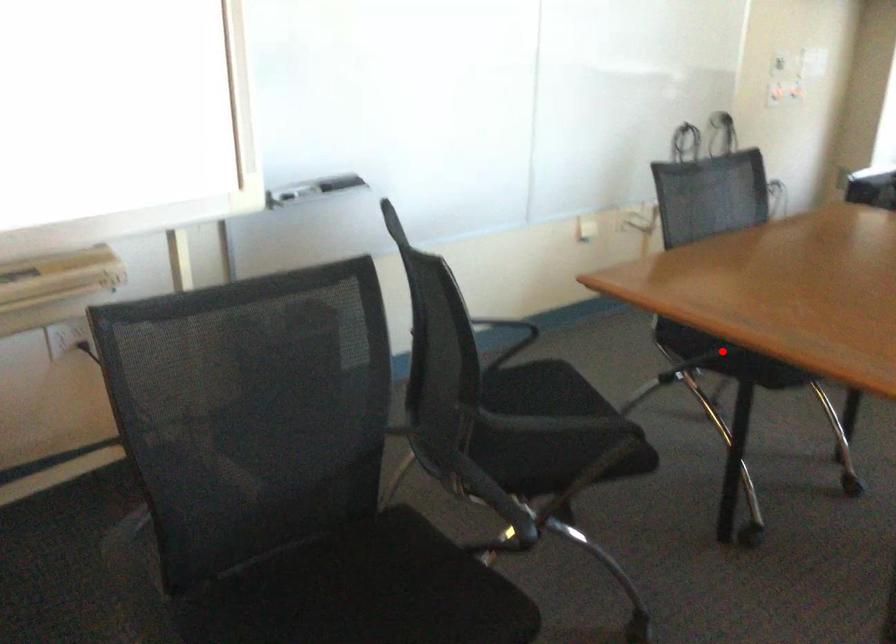
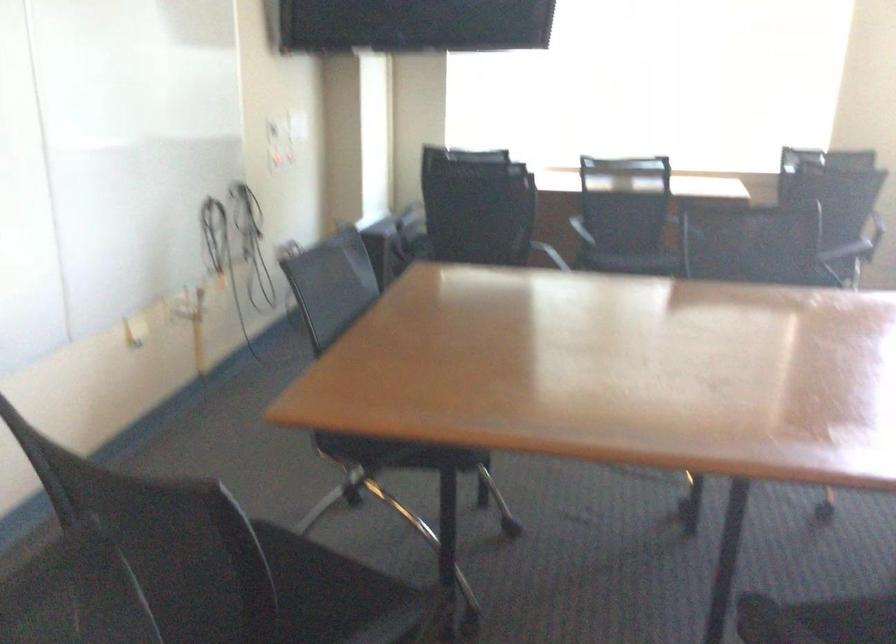
Where in the second image is the point corresponding to the highlighted location from the first image?

(400, 453)